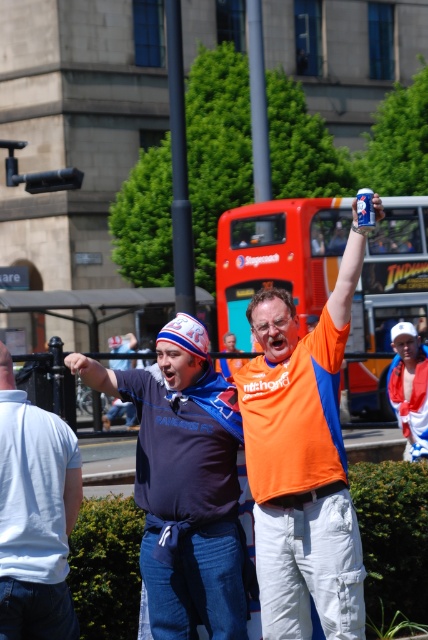
Does orange fabric shirt at center have a lesser height compared to dark blue jersey at center?

No, orange fabric shirt at center is not shorter than dark blue jersey at center.

Is point (262, 520) positioned in front of point (175, 323)?

Yes, point (262, 520) is closer to viewer.

Image resolution: width=428 pixels, height=640 pixels. What are the coordinates of `orange fabric shirt at center` in the screenshot? It's located at (303, 461).

Can you confirm if dark blue jersey at center is positioned above blue cotton shirt at center?

Actually, dark blue jersey at center is below blue cotton shirt at center.

Which is in front, point (235, 637) or point (2, 470)?

Point (2, 470)

Between point (148, 388) and point (14, 513), which one is positioned behind?

Positioned behind is point (148, 388).

Identify the location of dark blue jersey at center. (184, 483).

Which of these two, blue cotton shirt at center or white cotton cap at upper right, stands shorter?

white cotton cap at upper right is shorter.

Does blue cotton shirt at center have a lesser width compared to white cotton cap at upper right?

No.

I want to click on blue cotton shirt at center, so tap(35, 515).